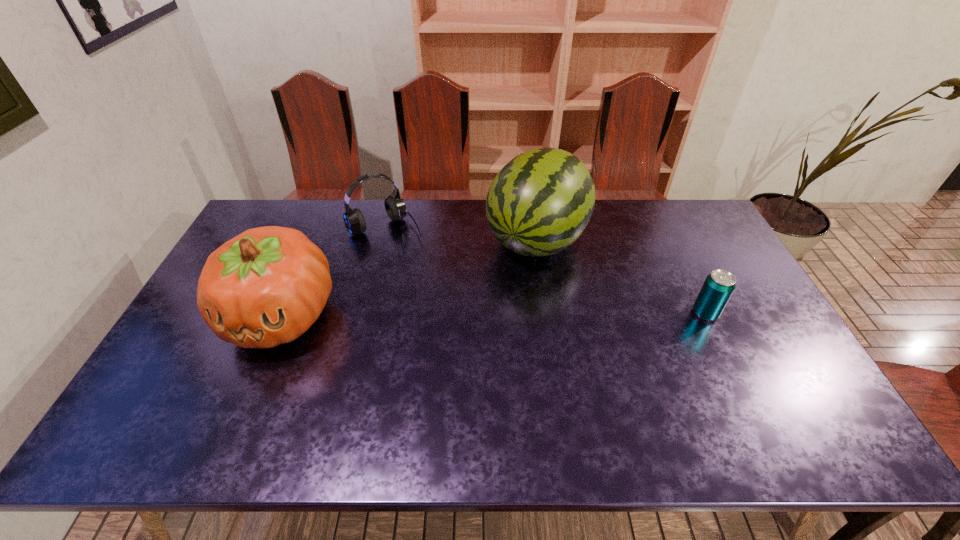
Identify the location of free spot at the near left corner of the desktop. (202, 397).

You are a GUI agent. You are given a task and a screenshot of the screen. Output one action in this format:
    pyautogui.click(x=<x>, y=<y>)
    Task: Click on the vacant point at the far right corner
    The height and width of the screenshot is (540, 960).
    Given the screenshot: What is the action you would take?
    pyautogui.click(x=689, y=214)

Locate an element on the screen. Image resolution: width=960 pixels, height=540 pixels. free space at the near right corner of the desktop is located at coordinates (774, 406).

Identify the location of vacant area that lies between the headset and the watermelon. The height and width of the screenshot is (540, 960). (462, 233).

The width and height of the screenshot is (960, 540). I want to click on blank region between the pumpkin and the third tallest object, so click(334, 271).

Locate an element on the screen. The width and height of the screenshot is (960, 540). unoccupied position between the pumpkin and the watermelon is located at coordinates (409, 278).

What are the coordinates of `vacant space that's between the pumpkin and the third tallest object` in the screenshot? It's located at (334, 271).

At what (x,y) coordinates should I click in order to perform the action: click on vacant space that's between the pumpkin and the shortest object. Please return your answer as a coordinate pair (x, y). This screenshot has height=540, width=960. Looking at the image, I should click on (493, 314).

This screenshot has height=540, width=960. I want to click on unoccupied position between the watermelon and the pumpkin, so click(409, 278).

I want to click on free space between the headset and the watermelon, so click(462, 233).